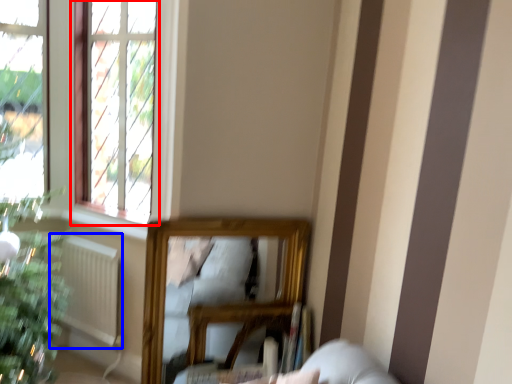
Question: Which object is further to the camera taking this photo, window (highlighted by a red box) or radiator (highlighted by a blue box)?

Choices:
 (A) window
 (B) radiator

Answer: (B)